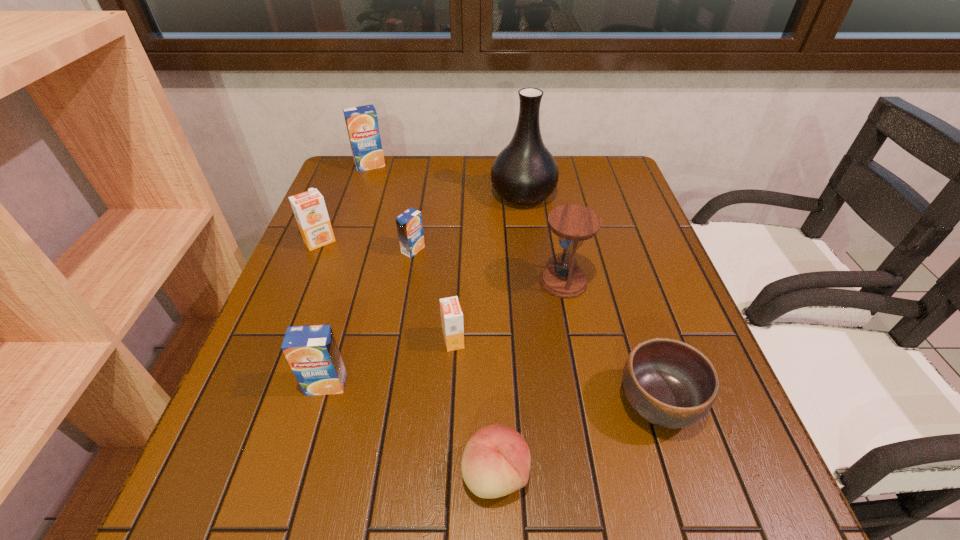
At what (x,y) coordinates should I click in order to perform the action: click on vacant space located on the front of the smallest blue orange_juice. Please return your answer as a coordinate pair (x, y). The image size is (960, 540). Looking at the image, I should click on (391, 380).

This screenshot has height=540, width=960. Identify the location of free region located 0.180m on the left of the smaller orange orange juice. (354, 340).

The image size is (960, 540). Find the location of `blank area located on the back of the bowl`. blank area located on the back of the bowl is located at coordinates (609, 251).

The height and width of the screenshot is (540, 960). Find the location of `vacant space located on the back of the peach`. vacant space located on the back of the peach is located at coordinates (492, 351).

Identify the location of vase that is at the far edge. (525, 172).

Where is `orange_juice present at the far edge`? The width and height of the screenshot is (960, 540). orange_juice present at the far edge is located at coordinates (362, 125).

Find the location of a particular element. object that is at the near edge is located at coordinates (496, 460).

Locate an element on the screen. The width and height of the screenshot is (960, 540). object that is at the right edge is located at coordinates pos(669,383).

This screenshot has width=960, height=540. What are the coordinates of `object at the far left corner` in the screenshot? It's located at click(362, 125).

In the image, there is a desktop. Identify the location of free space at the far edge. The image size is (960, 540). (426, 174).